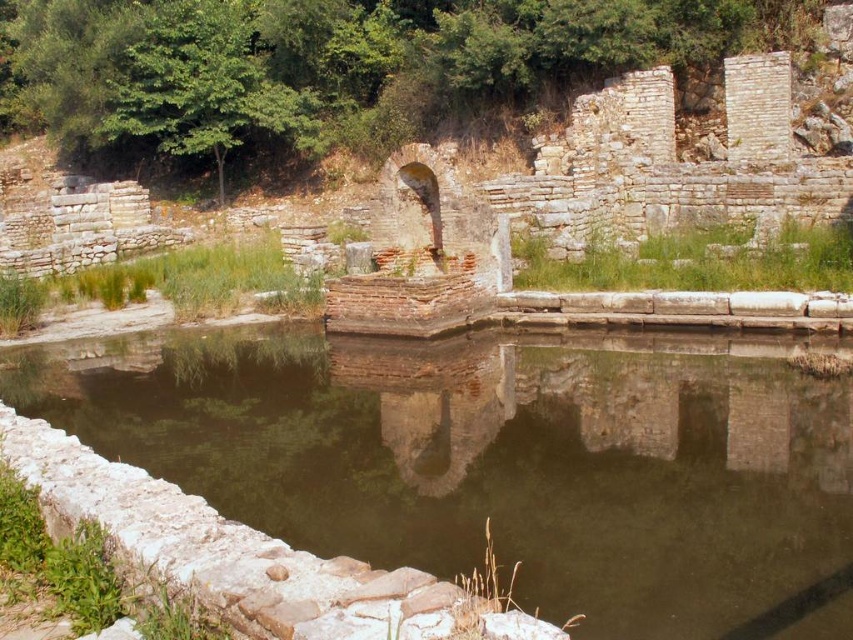
Is smooth stone pool at center above white stone moat at lower left?

Yes.

Consider the image. Which of these two, smooth stone pool at center or white stone moat at lower left, stands taller?

With more height is smooth stone pool at center.

Who is more forward, (502,465) or (380,627)?

Point (380,627)

In order to click on smooth stone pool at center in this screenshot , I will do `click(500, 460)`.